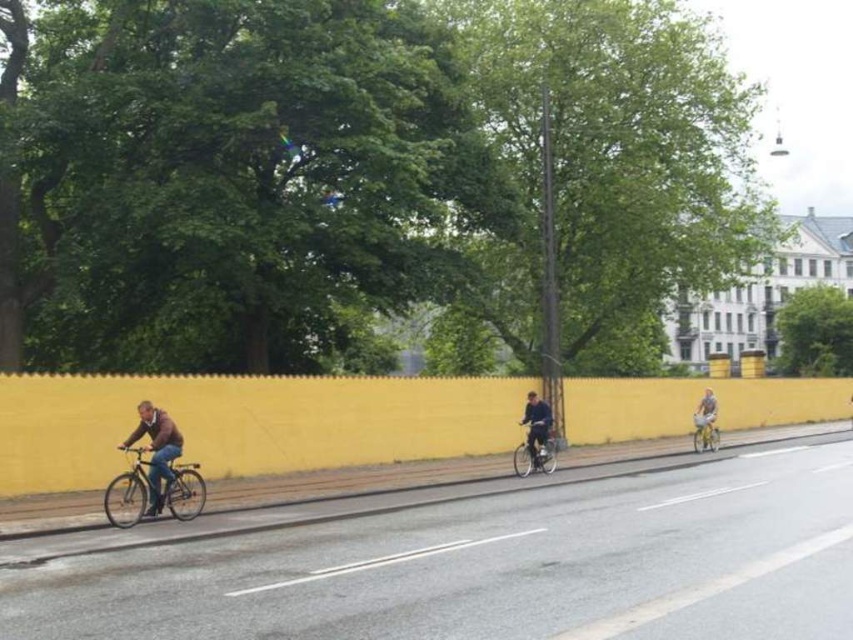
Question: Is shiny metallic bicycle at center thinner than shiny silver bicycle at right?

Choices:
 (A) no
 (B) yes

Answer: (A)

Question: Observing the image, what is the correct spatial positioning of brown leather jacket at left in reference to black matte bicycle helmet at center?

Choices:
 (A) right
 (B) left

Answer: (B)

Question: Can you confirm if brown leather jacket at left is thinner than black matte bicycle helmet at center?

Choices:
 (A) no
 (B) yes

Answer: (B)

Question: Which point is closer to the camera taking this photo?

Choices:
 (A) (706, 387)
 (B) (422, 508)

Answer: (B)

Question: Which point is farther from the camera taking this photo?

Choices:
 (A) [x=527, y=420]
 (B) [x=698, y=416]

Answer: (B)

Question: Which point appears farthest from the camera in this image?

Choices:
 (A) (161, 490)
 (B) (543, 458)

Answer: (B)